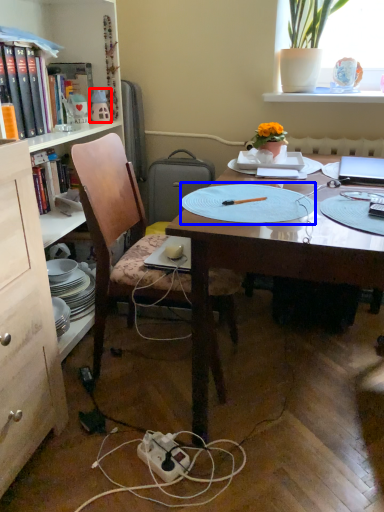
Question: Which object appears closest to the camera in this image, toy (highlighted by a red box) or paper plate (highlighted by a blue box)?

Choices:
 (A) toy
 (B) paper plate

Answer: (B)